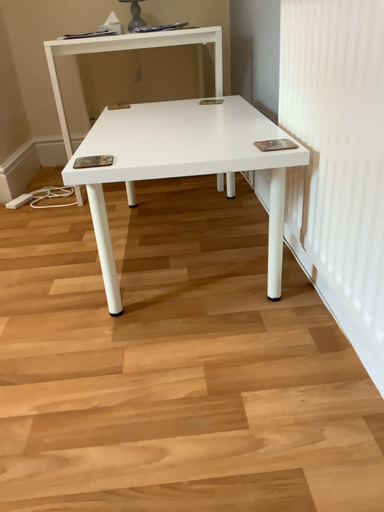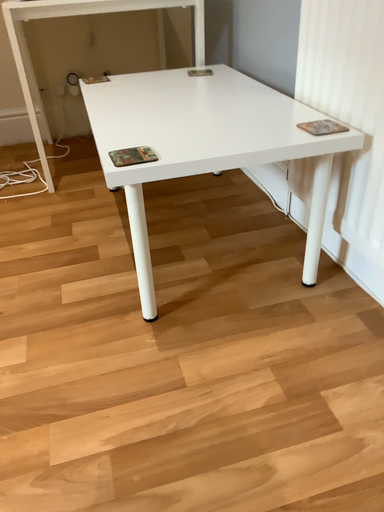
Question: Which way did the camera rotate in the video?

Choices:
 (A) rotated right
 (B) rotated left

Answer: (A)